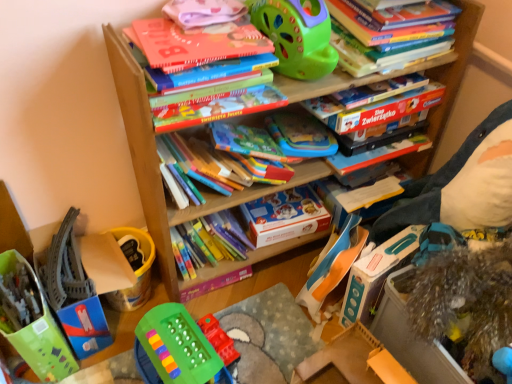
Question: From the image's perspective, is wooden toy at lower right beneath rubberized plastic toy at center, arranged as the third toy when viewed from the left?

Choices:
 (A) yes
 (B) no

Answer: (A)

Question: From the image's perspective, would you say wooden toy at lower right is positioned over rubberized plastic toy at center, the 4th toy viewed from the right?

Choices:
 (A) yes
 (B) no

Answer: (B)

Question: From a real-world perspective, does wooden toy at lower right sit lower than rubberized plastic toy at center, the 4th toy viewed from the right?

Choices:
 (A) no
 (B) yes

Answer: (A)

Question: Is wooden toy at lower right placed right next to rubberized plastic toy at center, the 4th toy viewed from the right?

Choices:
 (A) no
 (B) yes

Answer: (A)

Question: Is wooden toy at lower right thinner than rubberized plastic toy at center, arranged as the third toy when viewed from the left?

Choices:
 (A) no
 (B) yes

Answer: (A)

Question: Is shiny metallic tinsel at lower right, positioned as the 1th toy in right-to-left order, inside or outside of blue plastic toy at lower right, the second toy viewed from the right?

Choices:
 (A) outside
 (B) inside

Answer: (A)

Question: From the image's perspective, is shiny metallic tinsel at lower right, positioned as the 1th toy in right-to-left order, positioned above or below blue plastic toy at lower right, the second toy viewed from the right?

Choices:
 (A) below
 (B) above

Answer: (A)

Question: Visually, is shiny metallic tinsel at lower right, which ranks as the 6th toy in left-to-right order, positioned to the left or to the right of blue plastic toy at lower right, the second toy viewed from the right?

Choices:
 (A) right
 (B) left

Answer: (A)

Question: From a real-world perspective, is shiny metallic tinsel at lower right, positioned as the 1th toy in right-to-left order, positioned above or below blue plastic toy at lower right, the second toy viewed from the right?

Choices:
 (A) below
 (B) above

Answer: (A)

Question: Looking at the image, does matte orange book at upper center, the 4th book in the bottom-to-top sequence, seem bigger or smaller compared to green plastic toy at lower center, which is the fifth toy from right to left?

Choices:
 (A) big
 (B) small

Answer: (A)

Question: Considering the positions of matte orange book at upper center, acting as the 2th book starting from the top, and green plastic toy at lower center, which is the second toy in left-to-right order, in the image, is matte orange book at upper center, acting as the 2th book starting from the top, taller or shorter than green plastic toy at lower center, which is the second toy in left-to-right order,?

Choices:
 (A) tall
 (B) short

Answer: (B)

Question: From a real-world perspective, is matte orange book at upper center, the 4th book in the bottom-to-top sequence, positioned above or below green plastic toy at lower center, which is the second toy in left-to-right order?

Choices:
 (A) below
 (B) above

Answer: (B)

Question: Is point (257, 84) closer or farther from the camera than point (181, 354)?

Choices:
 (A) farther
 (B) closer

Answer: (B)

Question: Looking at the image, does blue plastic toy at lower right, the second toy viewed from the right, seem bigger or smaller compared to green plastic toy at lower center, which is the second toy in left-to-right order?

Choices:
 (A) big
 (B) small

Answer: (A)

Question: From the image's perspective, is blue plastic toy at lower right, the second toy viewed from the right, positioned above or below green plastic toy at lower center, which is the second toy in left-to-right order?

Choices:
 (A) above
 (B) below

Answer: (A)